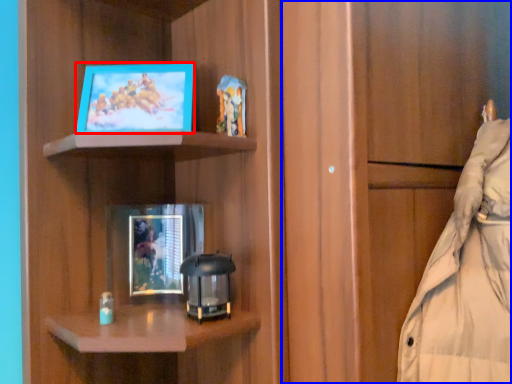
Question: Among these objects, which one is nearest to the camera, picture frame (highlighted by a red box) or cabinetry (highlighted by a blue box)?

Choices:
 (A) picture frame
 (B) cabinetry

Answer: (B)